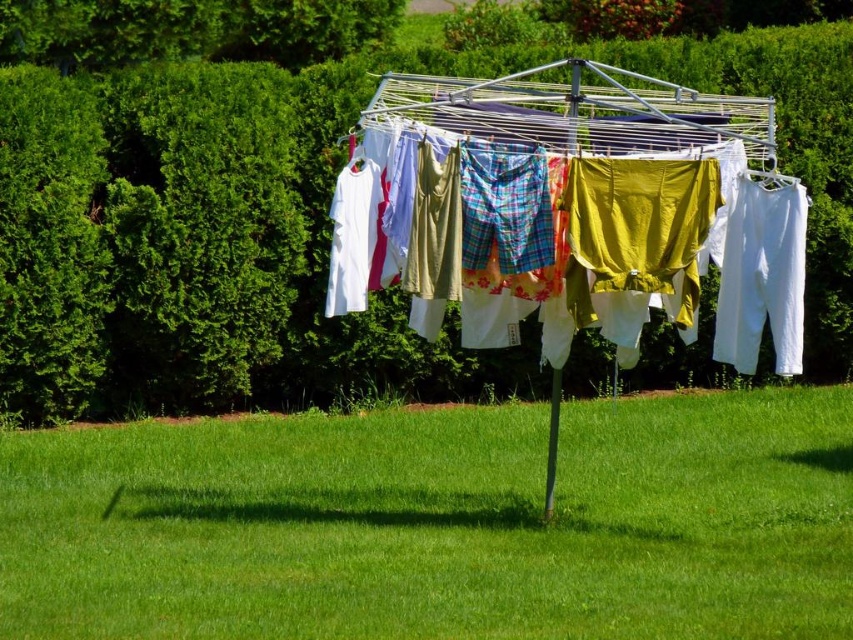
You are a gardener who wants to hang a new pair of socks on the clothesline. The socks are 10cm tall. You see the plaid fabric shorts at center and the white cotton pants at right. Which object can you place the socks above without overlapping?

The plaid fabric shorts at center is taller than the white cotton pants at right, so placing the socks above the white cotton pants at right would prevent overlapping since the socks are shorter than the pants.

From the picture: You are planning to pack a small backpack for a hike and need to decide between the plaid fabric shorts at center and the white cotton pants at right. Given their sizes, which one might be easier to pack due to being smaller?

The white cotton pants at right are smaller in width than the plaid fabric shorts at center, so they would be easier to pack in a small backpack.